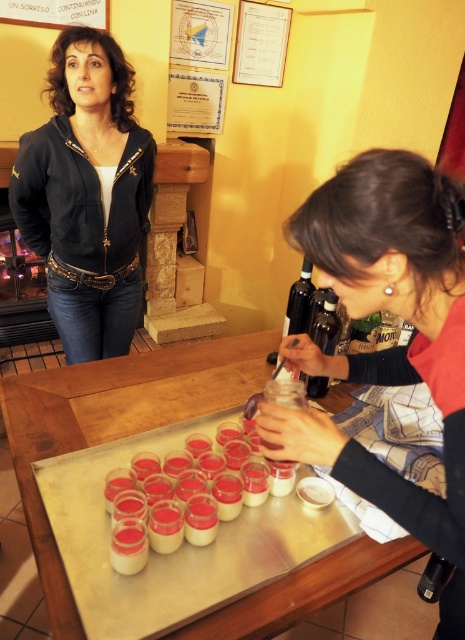
Question: Which point is farther to the camera?

Choices:
 (A) white creamy pudding at center
 (B) dark glass bottle at center

Answer: (B)

Question: Which is nearer to the black leather jacket at upper left?

Choices:
 (A) dark glass bottle at center
 (B) translucent glass bottle at center

Answer: (A)

Question: Based on their relative distances, which object is nearer to the white creamy pudding at center?

Choices:
 (A) black leather jacket at upper left
 (B) matte black shirt at center
 (C) wooden table at center
 (D) translucent glass bottle at center

Answer: (C)

Question: Is white creamy pudding at center thinner than translucent glass bottle at center?

Choices:
 (A) yes
 (B) no

Answer: (B)

Question: Can you confirm if wooden table at center is bigger than white creamy pudding at center?

Choices:
 (A) no
 (B) yes

Answer: (B)

Question: Is black leather jacket at upper left to the left of dark glass bottle at center from the viewer's perspective?

Choices:
 (A) no
 (B) yes

Answer: (B)